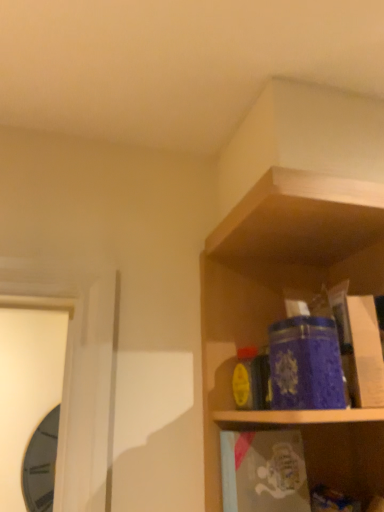
Question: Should I look upward or downward to see blue textured glass jar at upper right?

Choices:
 (A) down
 (B) up

Answer: (A)